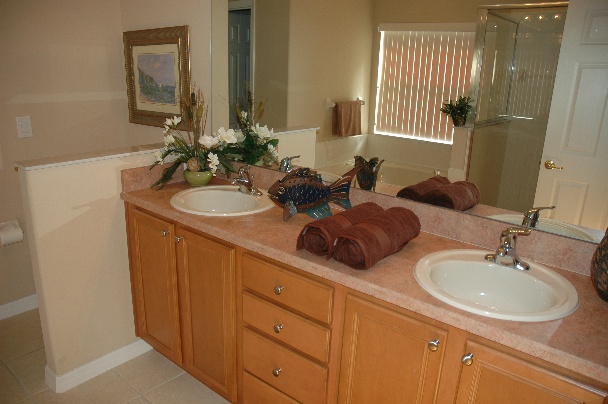
Locate an element on the screen. This screenshot has width=608, height=404. cabinet door is located at coordinates (149, 282), (205, 297), (384, 345), (492, 381).